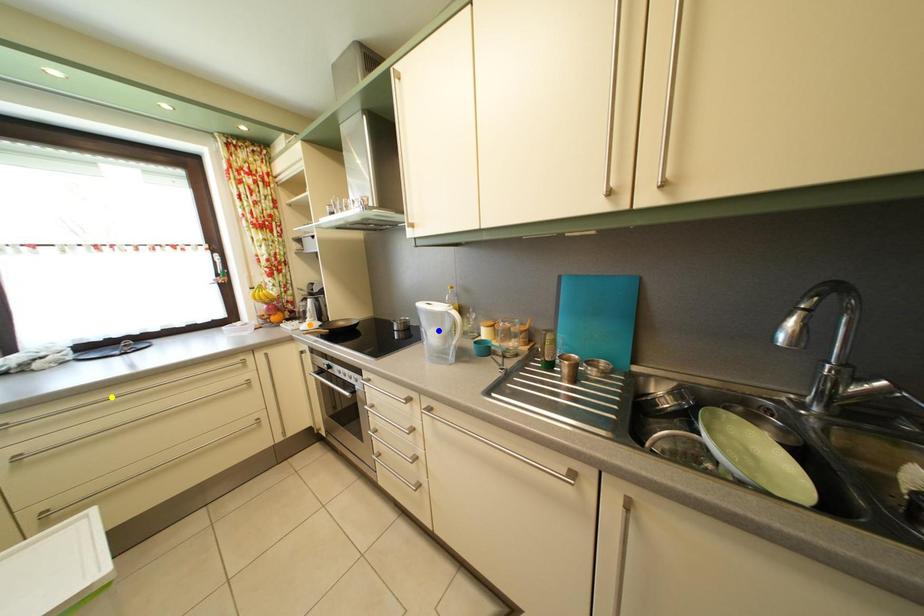
Order these from farthest to nearest:
blue point, orange point, yellow point

orange point < blue point < yellow point